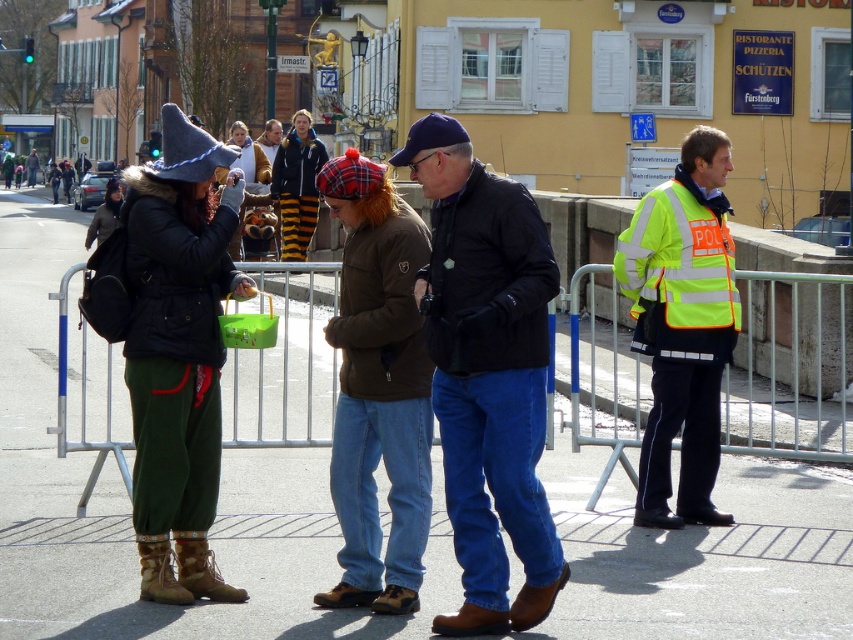
You are a delivery person who needs to drop off a package at the exact location of the brown leather jacket at center. The coordinates given are in a system where the bottom left corner of the image is the origin point. Can you confirm if the coordinates provided are correct based on the image?

The coordinates of the brown leather jacket at center are indeed at point (378,388) in the system where the bottom left corner is the origin point.